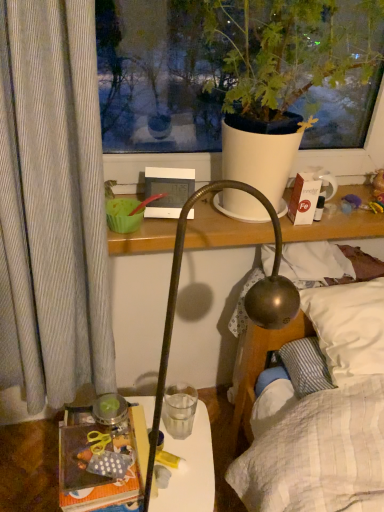
This screenshot has height=512, width=384. In order to click on blank space above polka dot fabric book at lower left (from a real-world perspective) in this screenshot , I will do `click(100, 447)`.